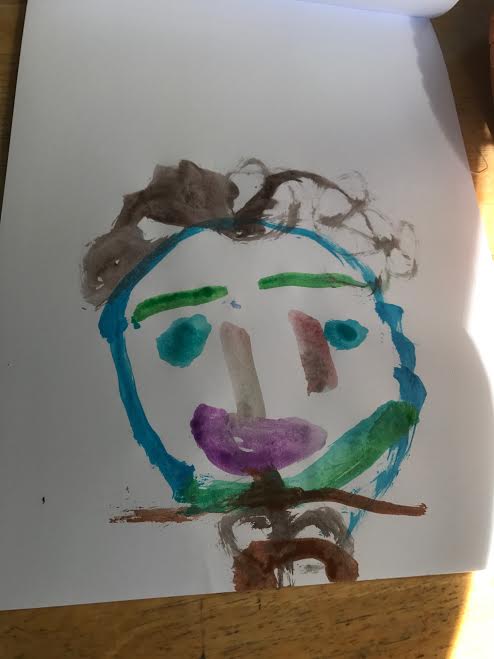
The height and width of the screenshot is (659, 494). In order to click on artwork in this screenshot , I will do `click(446, 484)`.